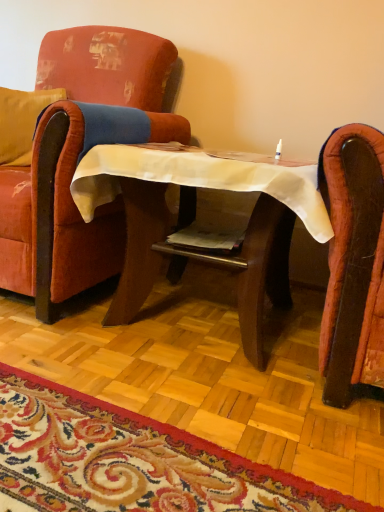
Find the location of a particular element. The width and height of the screenshot is (384, 512). free point below wooden table at center (from a real-world perspective) is located at coordinates (201, 343).